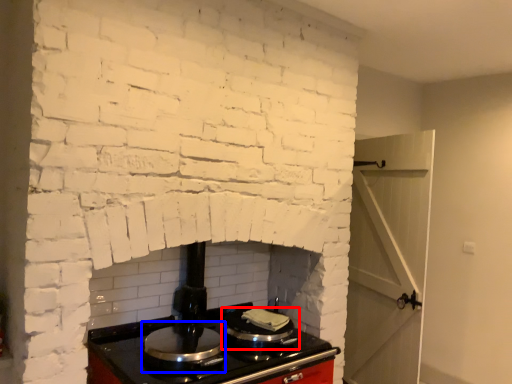
Question: Among these objects, which one is farthest to the camera, kitchen appliance (highlighted by a red box) or appliance (highlighted by a blue box)?

Choices:
 (A) kitchen appliance
 (B) appliance

Answer: (A)